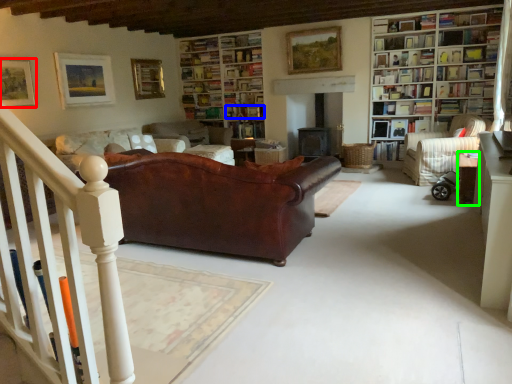
Question: Which is farther away from picture frame (highlighted by a red box)? book (highlighted by a blue box) or table (highlighted by a green box)?

Choices:
 (A) book
 (B) table

Answer: (B)